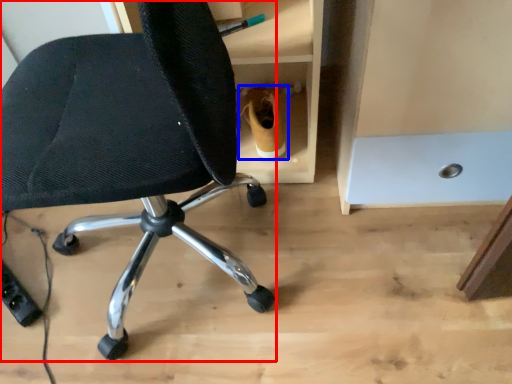
Question: Which object appears closest to the camera in this image, chair (highlighted by a red box) or footwear (highlighted by a blue box)?

Choices:
 (A) chair
 (B) footwear

Answer: (A)